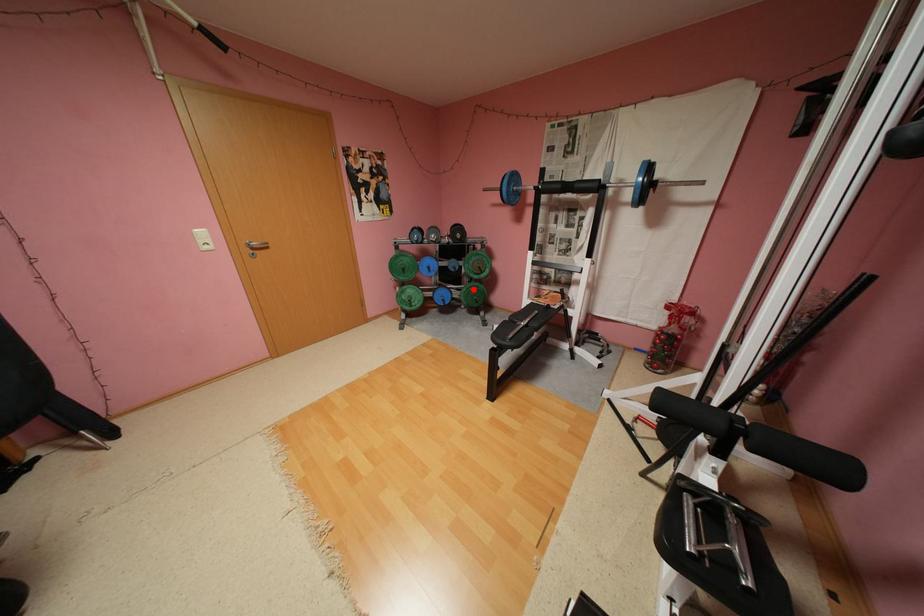
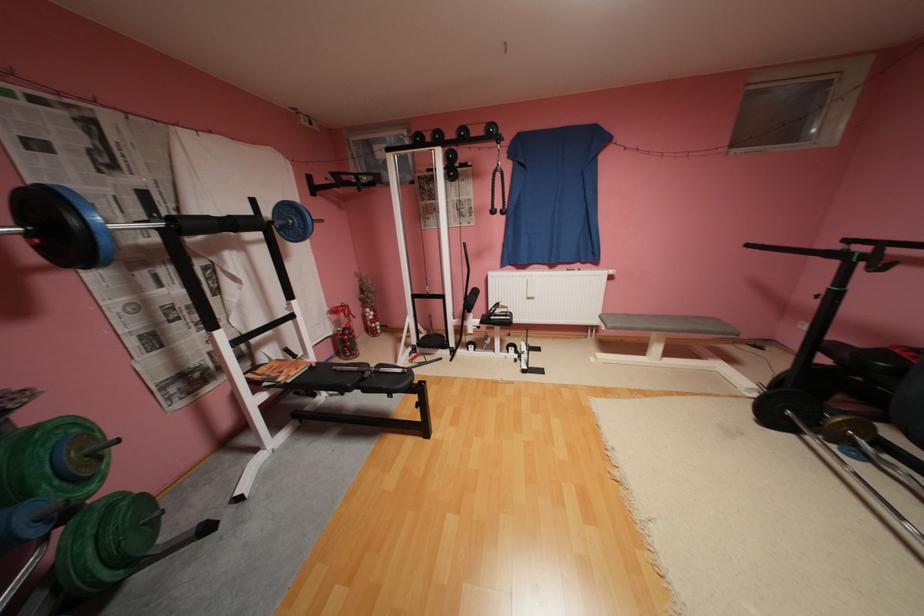
Question: I am providing you with two images of the same scene from different viewpoints. In image1, a red point is highlighted. Considering the same 3D point in image2, which of the following is correct?

Choices:
 (A) It is closer
 (B) It is farther

Answer: (B)